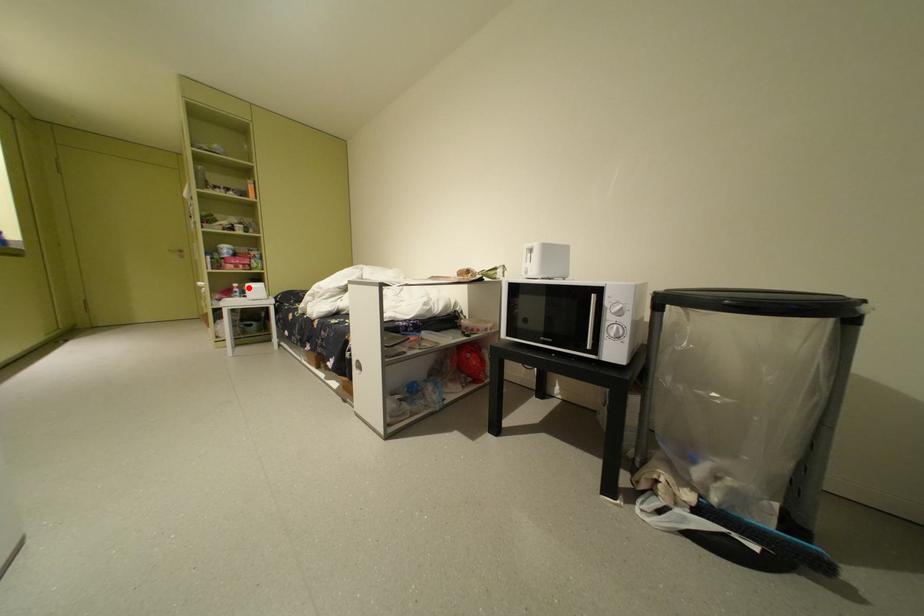
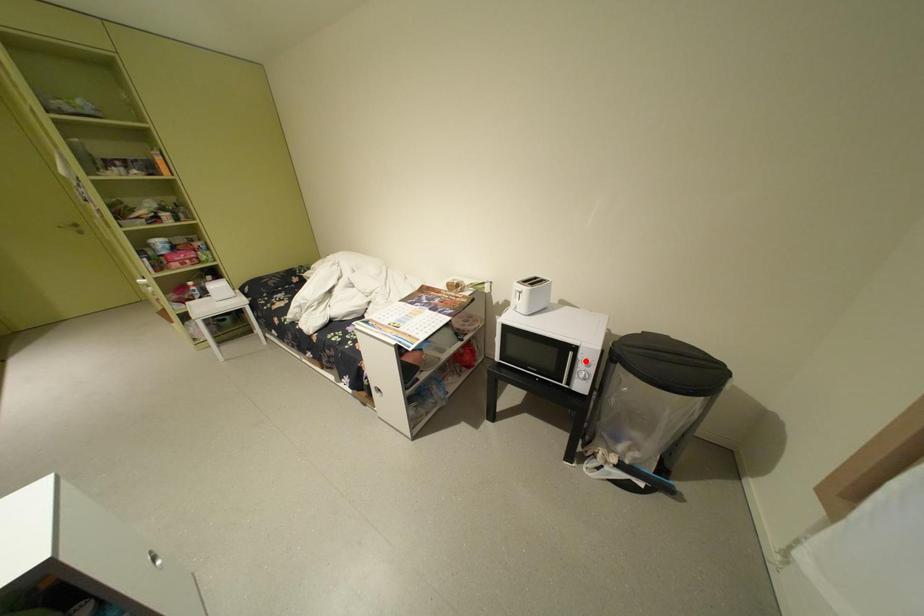
I am providing you with two images of the same scene from different viewpoints. A red point is marked on the first image and another point is marked on the second image. Is the red point in image1 aligned with the point shown in image2?

No